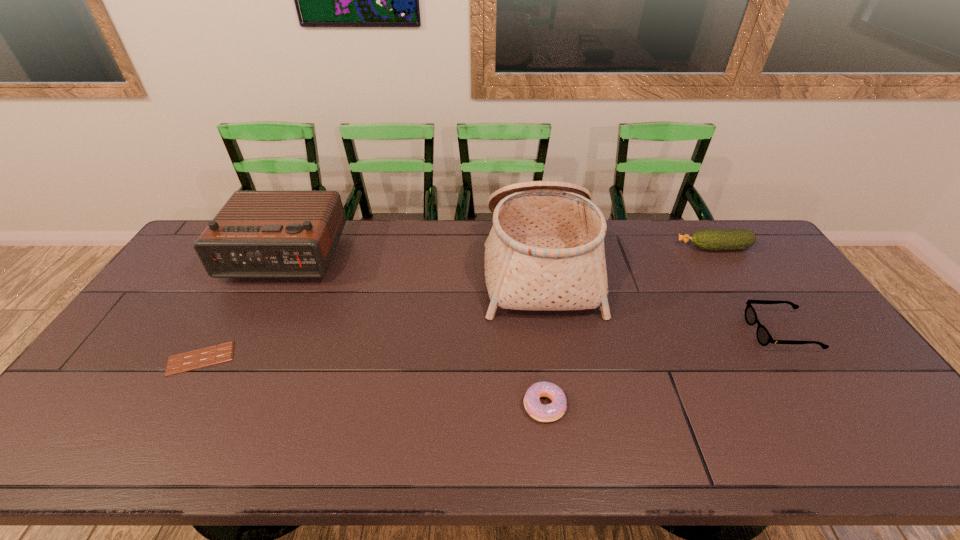
Image resolution: width=960 pixels, height=540 pixels. I want to click on basket, so click(545, 251).

This screenshot has width=960, height=540. I want to click on radio receiver, so click(257, 234).

Identify the location of the third tallest object. (736, 239).

Find the location of a particular element. The height and width of the screenshot is (540, 960). the fourth tallest object is located at coordinates (764, 338).

At what (x,y) coordinates should I click in order to perform the action: click on the second shortest object. Please return your answer as a coordinate pair (x, y). Image resolution: width=960 pixels, height=540 pixels. Looking at the image, I should click on (551, 412).

Where is `doughnut`? The height and width of the screenshot is (540, 960). doughnut is located at coordinates (551, 412).

What are the coordinates of `chocolate bar` in the screenshot? It's located at (195, 359).

I want to click on free spot located with the lid open on the basket, so click(440, 265).

Where is `free space located 0.220m with the lid open on the basket`? free space located 0.220m with the lid open on the basket is located at coordinates (419, 265).

Identify the location of free space located 0.400m with the lid open on the basket. (365, 265).